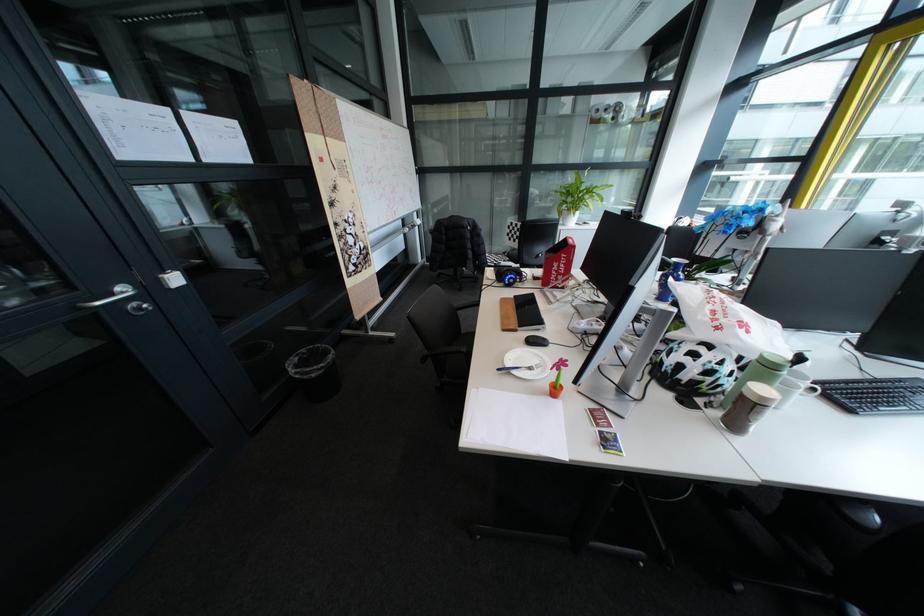
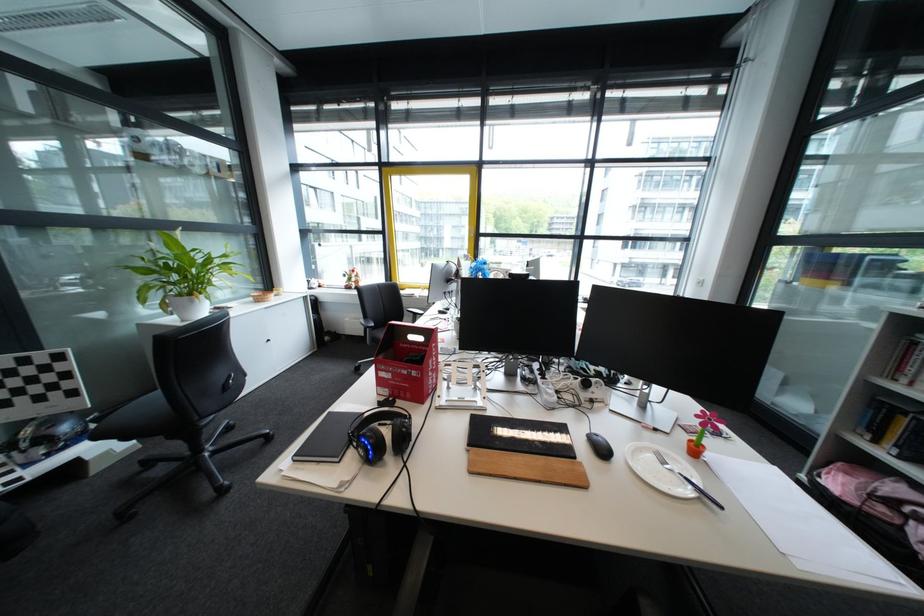
Find the pixel in the second image that matches [581,215] in the first image.

(207, 302)